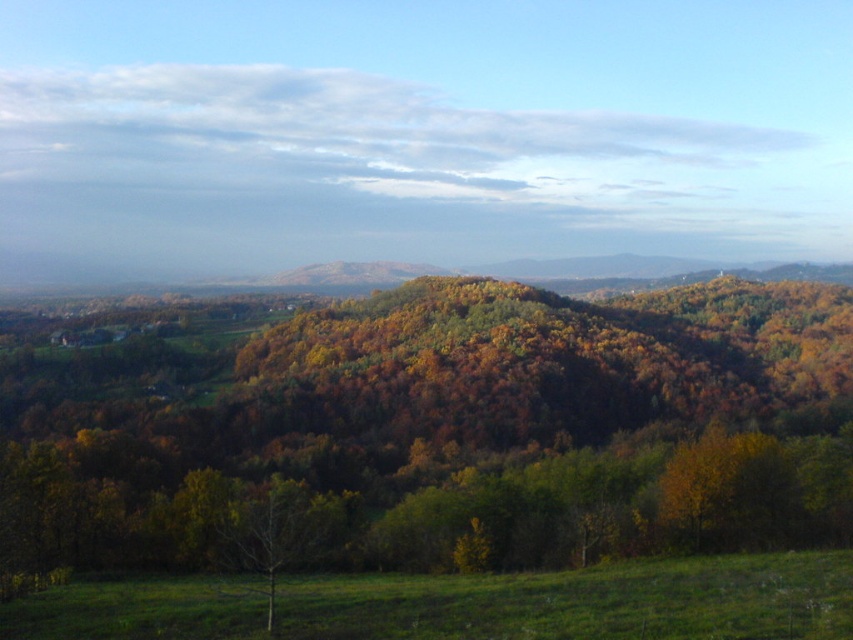
Who is positioned more to the right, autumn leaves at center or bare branch at center?

Positioned to the right is bare branch at center.

Does autumn leaves at center have a greater width compared to bare branch at center?

Indeed, autumn leaves at center has a greater width compared to bare branch at center.

Measure the distance between point (231,564) and camera.

Point (231,564) and camera are 44.96 meters apart.

Identify the location of autumn leaves at center. (438, 435).